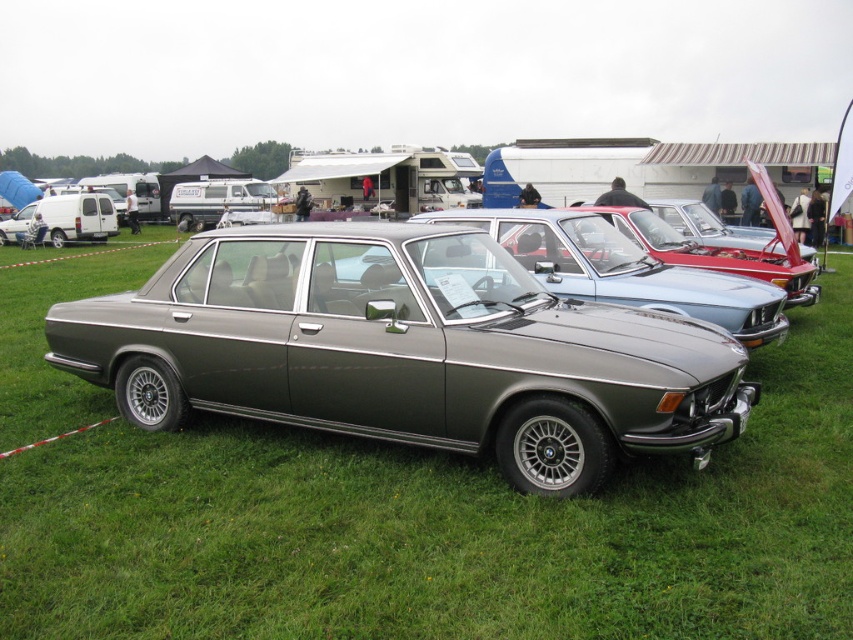
Question: Among these objects, which one is nearest to the camera?

Choices:
 (A) metallic gray sedan at center
 (B) satin metallic car at center

Answer: (B)

Question: Is satin metallic car at center smaller than metallic gray sedan at center?

Choices:
 (A) yes
 (B) no

Answer: (B)

Question: Does satin metallic car at center have a smaller size compared to metallic gray sedan at center?

Choices:
 (A) yes
 (B) no

Answer: (B)

Question: Can you confirm if satin metallic car at center is positioned below metallic gray sedan at center?

Choices:
 (A) yes
 (B) no

Answer: (A)

Question: Which object is farther from the camera taking this photo?

Choices:
 (A) satin metallic car at center
 (B) metallic gray sedan at center

Answer: (B)